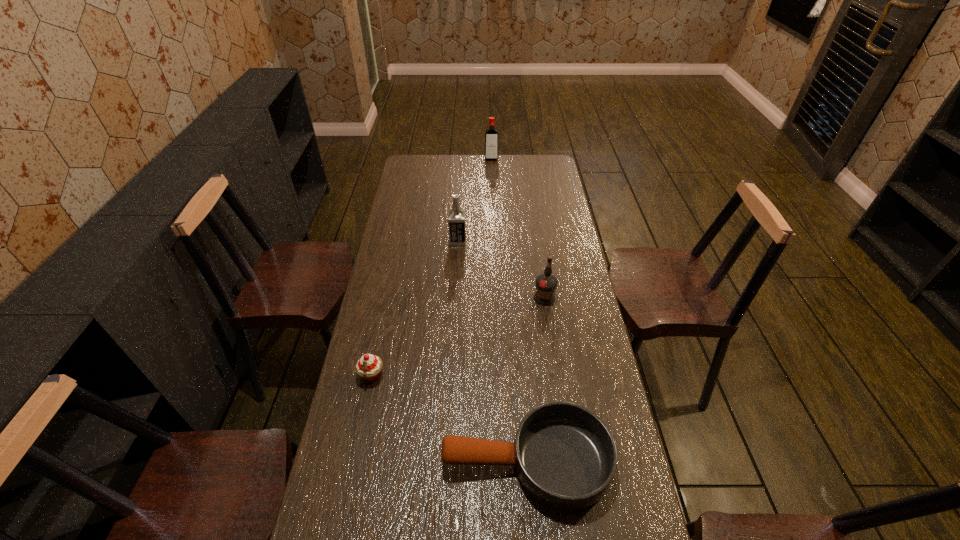
Where is `vacant point located between the nearest vodka and the second farthest object`? The width and height of the screenshot is (960, 540). vacant point located between the nearest vodka and the second farthest object is located at coordinates click(x=501, y=269).

At what (x,y) coordinates should I click in order to perform the action: click on vacant space in between the farthest vodka and the shortest object. Please return your answer as a coordinate pair (x, y). Looking at the image, I should click on (509, 310).

Identify the location of free spot between the fourth farthest object and the nearest vodka. (458, 337).

What are the coordinates of `blank region between the second nearest vodka and the nearest vodka` in the screenshot? It's located at [x=501, y=269].

Locate an element on the screen. vacant space that's between the pan and the cupcake is located at coordinates (449, 418).

I want to click on object that is the fourth nearest to the farthest vodka, so click(x=565, y=456).

Identify which object is the third closest to the second nearest vodka. Please provide its 2D coordinates. Your answer should be formatted as a tuple, i.e. [(x, y)], where the tuple contains the x and y coordinates of a point satisfying the conditions above.

[(491, 145)]

Locate an element on the screen. This screenshot has height=540, width=960. vodka that is the nearest to the nearest vodka is located at coordinates (456, 217).

Where is `vodka that is the third nearest to the second nearest object`? Image resolution: width=960 pixels, height=540 pixels. vodka that is the third nearest to the second nearest object is located at coordinates (491, 145).

Image resolution: width=960 pixels, height=540 pixels. I want to click on blank space that satisfies the following two spatial constraints: 1. on the front label of the nearest vodka; 2. on the handle side of the nearest object, so click(568, 461).